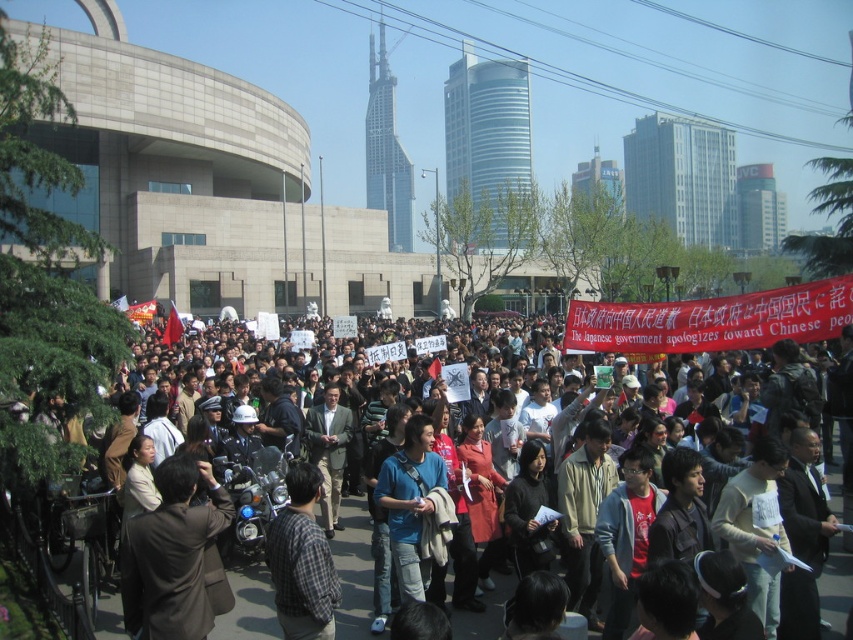
Question: Which point appears closest to the camera in this image?

Choices:
 (A) (363, 540)
 (B) (265, 490)
 (C) (297, 483)

Answer: (C)

Question: Which point appears closest to the camera in this image?

Choices:
 (A) (212, 460)
 (B) (392, 536)
 (C) (57, 636)

Answer: (C)

Question: Is multicolored fabric crowd at center bigger than shiny chrome motorcycle at lower left?

Choices:
 (A) yes
 (B) no

Answer: (A)

Question: Can you confirm if multicolored fabric crowd at center is positioned to the left of brown fabric coat at lower left?

Choices:
 (A) yes
 (B) no

Answer: (B)

Question: Among these points, which one is farthest from the camera?

Choices:
 (A) (138, 589)
 (B) (21, 572)
 (C) (325, 577)
 (D) (242, 481)

Answer: (D)

Question: Is multicolored fabric crowd at center to the right of blue cotton shirt at center from the viewer's perspective?

Choices:
 (A) no
 (B) yes

Answer: (B)